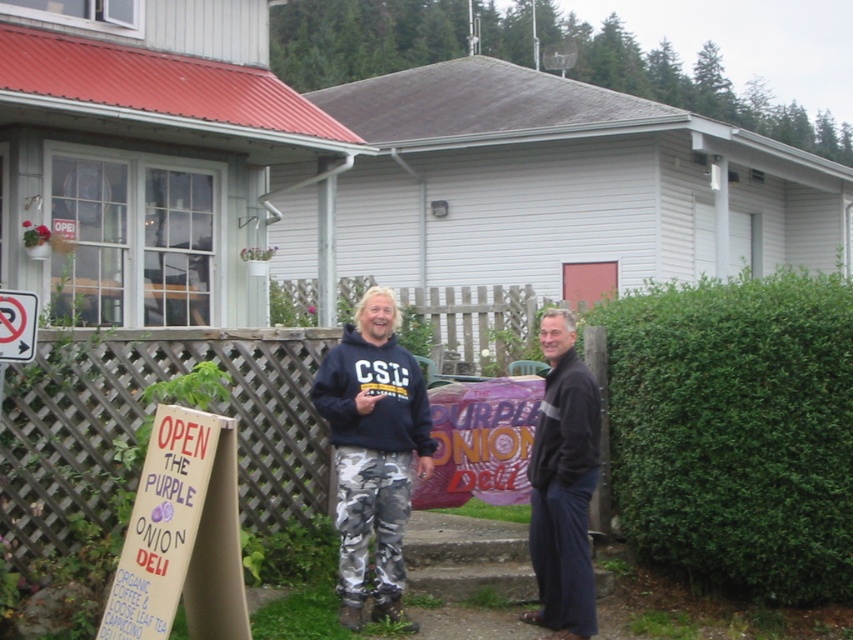
You are a delivery person trying to reach the deli entrance. You see the camouflage pants at center and the white plastic sign at upper left. Which object is closer to you as you approach the deli?

The camouflage pants at center is closer to you than the white plastic sign at upper left because it is further to the viewer.

Consider the image. You are standing in front of the building with a red roof and white siding. You want to locate the wooden signboard at lower left. Where exactly should you look?

You should look at point (183,536) to locate the wooden signboard at lower left.